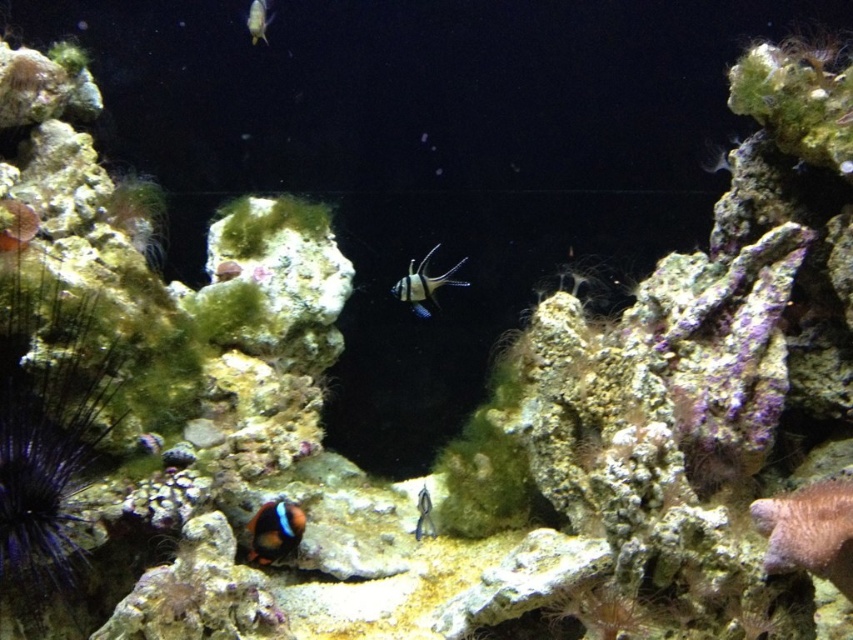
You are an underwater photographer aiming to capture a close shot of the striped fish in the center. Your camera has a maximum focus range of 2 meters. Is the point at coordinates point (405, 298) within your camera focus range?

The point at coordinates point (405, 298) is 2.59 meters away from the camera, which exceeds the camera maximum focus range of 2 meters. Therefore, the camera cannot focus on that point.

You are an underwater photographer aiming to capture the orange and black clownfish at lower center. Your camera is focused on point (276, 531). Is this point the correct location to capture the orange and black clownfish at lower center?

Yes, because the point (276, 531) corresponds to the orange and black clownfish at lower center, so focusing there will capture it.